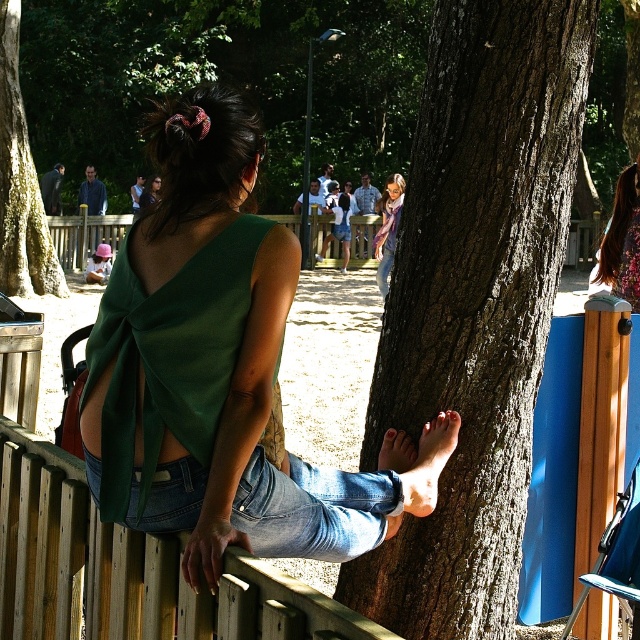
Question: Estimate the real-world distances between objects in this image. Which object is farther from the green fabric top at center?

Choices:
 (A) jeans at lower center
 (B) smooth brown bark at center
 (C) smooth brown tree trunk at left

Answer: (C)

Question: Is smooth brown bark at center positioned at the back of light brown hair at upper center?

Choices:
 (A) yes
 (B) no

Answer: (B)

Question: Which point appears closest to the camera in this image?

Choices:
 (A) (16, 26)
 (B) (310, 548)

Answer: (B)

Question: Is smooth brown bark at center bigger than jeans at lower center?

Choices:
 (A) yes
 (B) no

Answer: (A)

Question: Does smooth brown bark at center have a lesser width compared to jeans at lower center?

Choices:
 (A) no
 (B) yes

Answer: (A)

Question: Among these objects, which one is farthest from the camera?

Choices:
 (A) smooth brown tree trunk at left
 (B) light brown hair at upper center

Answer: (B)